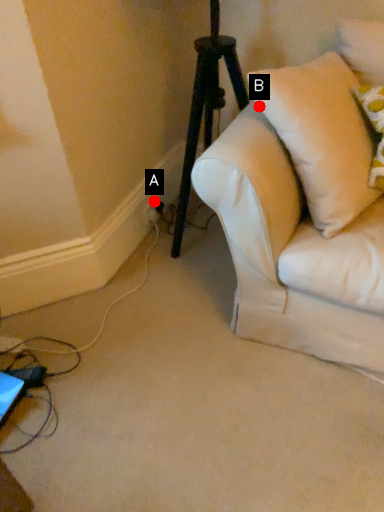
Question: Two points are circled on the image, labeled by A and B beside each circle. Which point appears farthest from the camera in this image?

Choices:
 (A) A is further
 (B) B is further

Answer: (A)